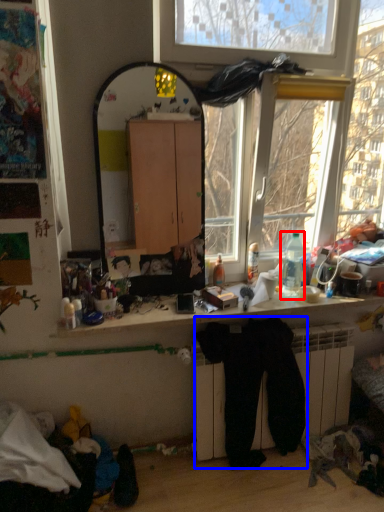
Question: Which of the following is the farthest to the observer, bottle (highlighted by a red box) or clothing (highlighted by a blue box)?

Choices:
 (A) bottle
 (B) clothing

Answer: (A)